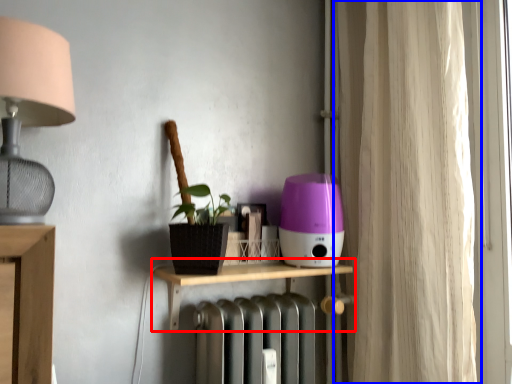
Question: Which of the following is the farthest to the observer, shelf (highlighted by a red box) or curtain (highlighted by a blue box)?

Choices:
 (A) shelf
 (B) curtain

Answer: (A)